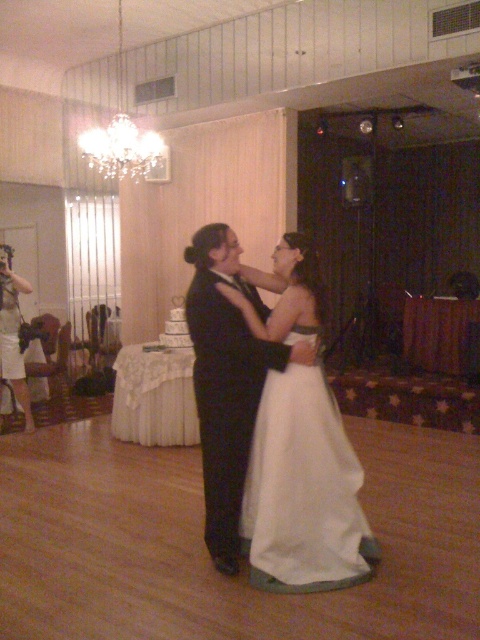
You are standing at the photographer position in the scene. You want to take a photo of both point (210, 337) and point (299, 548) in the image. Which point is closer to your camera?

Point (210, 337) is further to the camera than point (299, 548), so the point closer to the camera is point (299, 548).

You are a photographer at the wedding reception and want to capture a shot of the satin white dress at center. Where should you position yourself to ensure the dress is in the frame?

The satin white dress at center is located at point (x=272, y=420), so you should position yourself facing the center of the image to capture it within the frame.

You are a photographer at the wedding reception and want to capture a photo of both the satin white dress at center and the white satin dress at center. Which dress is on the left side when facing the couple?

The satin white dress at center is on the left side of the white satin dress at center.